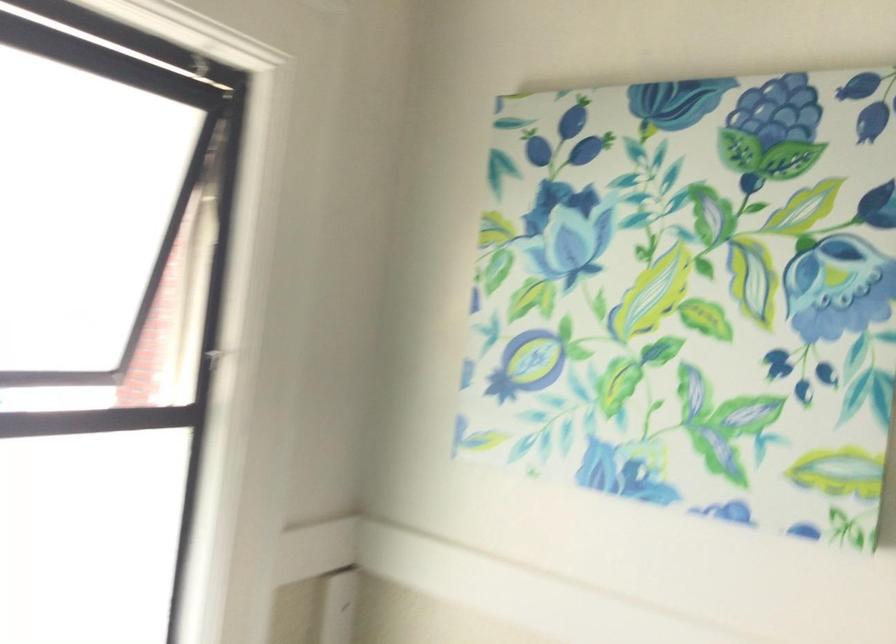
Where would you push the white window latch? Please return your answer as a coordinate pair (x, y).

(130, 381)